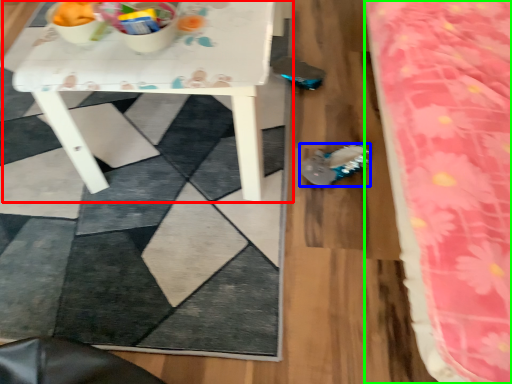
Question: Estimate the real-world distances between objects in this image. Which object is farther from table (highlighted by a red box), footwear (highlighted by a blue box) or bed (highlighted by a green box)?

Choices:
 (A) footwear
 (B) bed

Answer: (B)